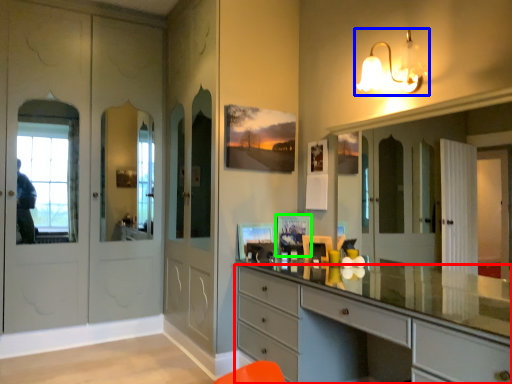
Question: Which object is the farthest from chest of drawers (highlighted by a red box)? Choose among these: light fixture (highlighted by a blue box) or picture frame (highlighted by a green box).

Choices:
 (A) light fixture
 (B) picture frame

Answer: (A)